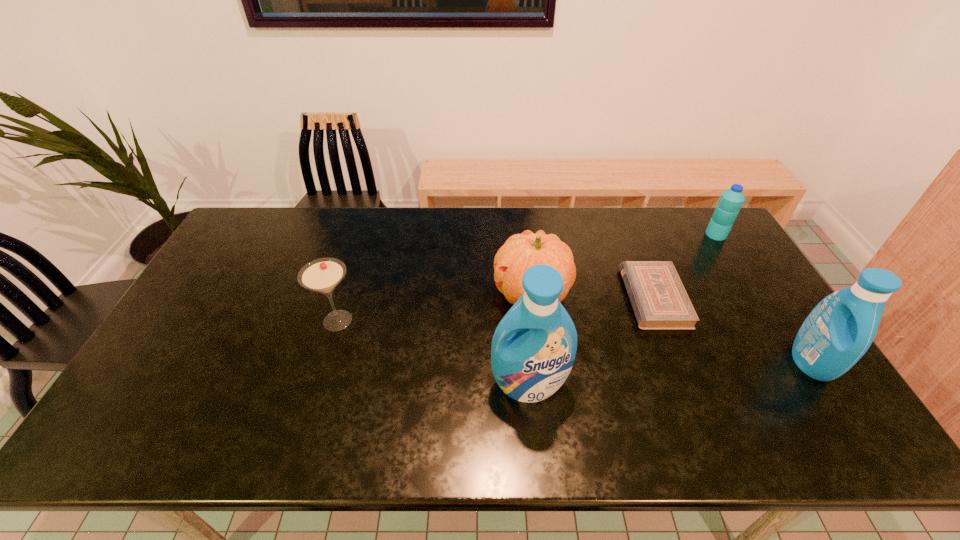
The width and height of the screenshot is (960, 540). I want to click on vacant space located 0.380m on the spine side of the third object from right to left, so click(502, 298).

Image resolution: width=960 pixels, height=540 pixels. In order to click on vacant position located 0.170m on the spine side of the third object from right to left in this screenshot , I will do `click(571, 298)`.

The height and width of the screenshot is (540, 960). Find the location of `vacant space located on the spine side of the third object from right to left`. vacant space located on the spine side of the third object from right to left is located at coordinates (498, 298).

At what (x,y) coordinates should I click in order to perform the action: click on vacant area situated on the back of the leftmost object. Please return your answer as a coordinate pair (x, y). Looking at the image, I should click on (358, 252).

Where is `vacant space located on the carved face of the pumpkin`? vacant space located on the carved face of the pumpkin is located at coordinates (363, 293).

You are a GUI agent. You are given a task and a screenshot of the screen. Output one action in this format:
    pyautogui.click(x=<x>, y=<y>)
    Task: Click on the free space located 0.350m on the carved face of the pumpkin
    
    Given the screenshot: What is the action you would take?
    pyautogui.click(x=379, y=293)

Find the location of a particular element. free space located 0.060m on the carved face of the pumpkin is located at coordinates (473, 293).

At what (x,y) coordinates should I click in order to perform the action: click on object present at the far edge. Please return your answer as a coordinate pair (x, y). The image size is (960, 540). Looking at the image, I should click on (731, 200).

The width and height of the screenshot is (960, 540). I want to click on detergent at the right edge, so click(840, 329).

Locate an element on the screen. This screenshot has width=960, height=540. water bottle at the right edge is located at coordinates (731, 200).